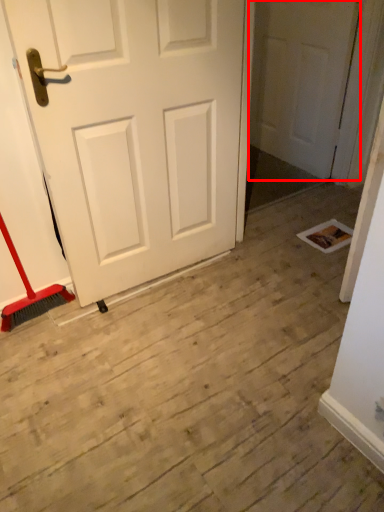
Question: From the image, what is the correct spatial relationship of door (annotated by the red box) in relation to door?

Choices:
 (A) left
 (B) right

Answer: (B)